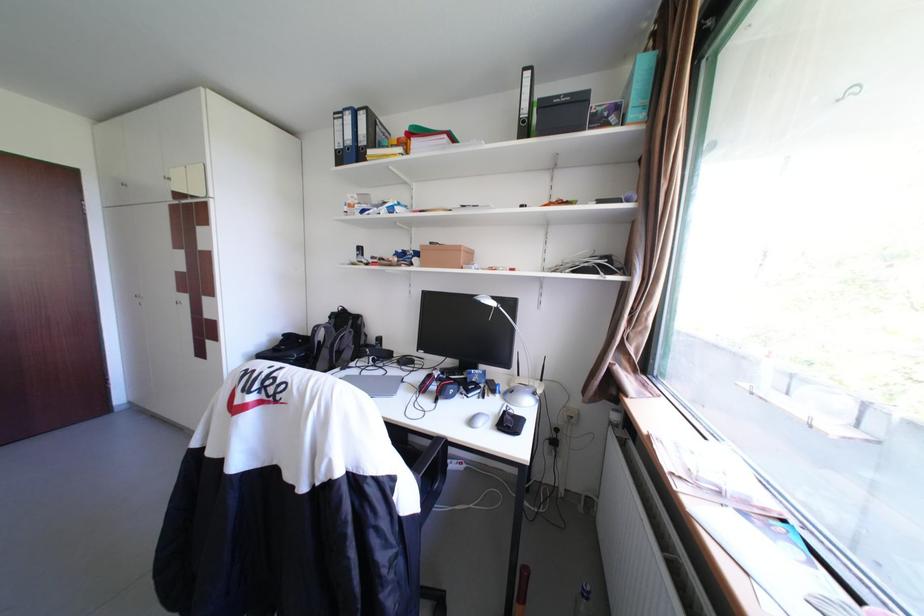
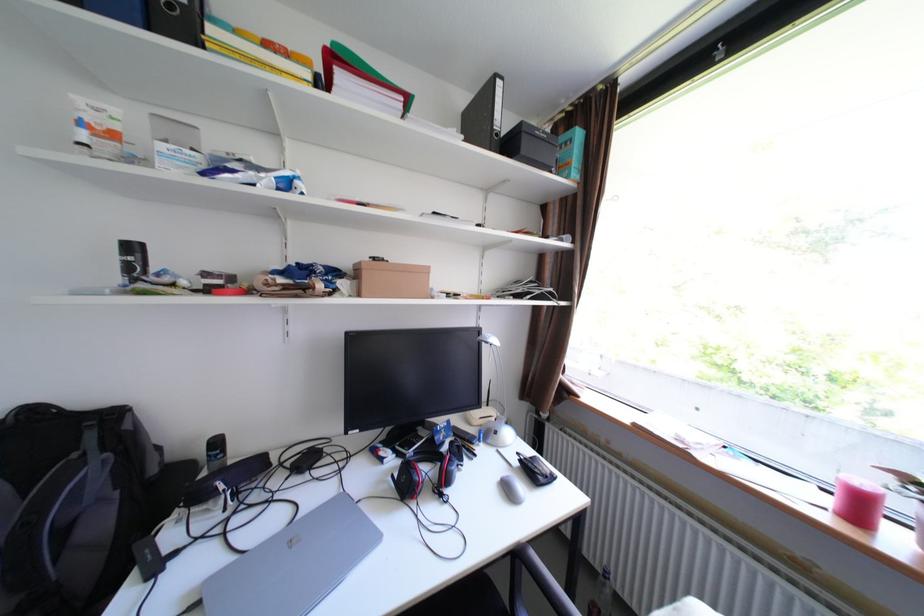
Locate, in the second image, the point that corresponds to [371,249] in the first image.

(143, 248)